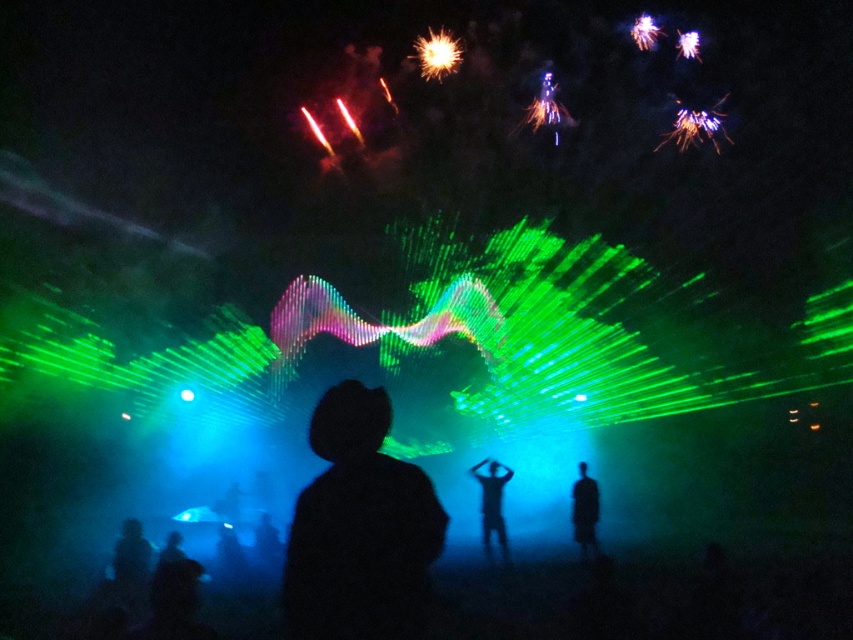
Can you confirm if black matte jacket at center is shorter than blue matte person at center?

Correct, black matte jacket at center is not as tall as blue matte person at center.

Can you confirm if black matte jacket at center is smaller than blue matte person at center?

Correct, black matte jacket at center occupies less space than blue matte person at center.

What are the coordinates of `black matte jacket at center` in the screenshot? It's located at pyautogui.click(x=358, y=529).

Between point (482, 497) and point (581, 554), which one is positioned in front?

Positioned in front is point (482, 497).

Which is above, black matte person at center or blue matte person at center?

blue matte person at center is higher up.

Does point (489, 488) come in front of point (573, 525)?

No, (489, 488) is further to viewer.

Identify the location of black matte person at center. The height and width of the screenshot is (640, 853). (492, 502).

Does black matte jacket at center have a greater height compared to black matte person at center?

Incorrect, black matte jacket at center's height is not larger of black matte person at center's.

Can you confirm if black matte jacket at center is thinner than black matte person at center?

Indeed, black matte jacket at center has a lesser width compared to black matte person at center.

This screenshot has height=640, width=853. Find the location of `black matte jacket at center`. black matte jacket at center is located at coordinates (358, 529).